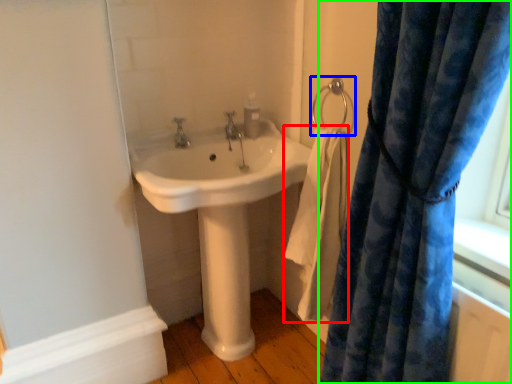
Question: Based on their relative distances, which object is farther from bath towel (highlighted by a red box)? Choose from shower (highlighted by a blue box) and curtain (highlighted by a green box).

Choices:
 (A) shower
 (B) curtain

Answer: (B)